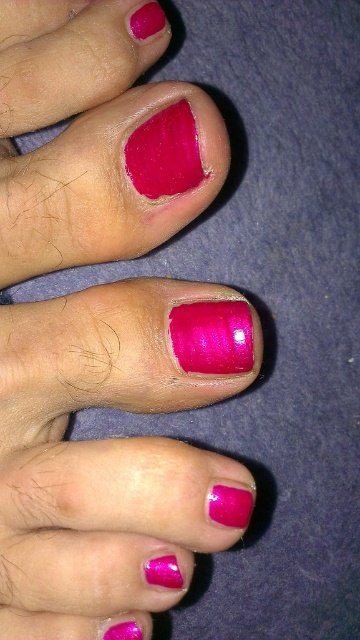
Can you confirm if glossy pink nail at center is positioned to the left of glossy pink nail polish at center?

Indeed, glossy pink nail at center is positioned on the left side of glossy pink nail polish at center.

Is glossy pink nail at center below glossy pink nail polish at center?

Incorrect, glossy pink nail at center is not positioned below glossy pink nail polish at center.

What do you see at coordinates (106, 464) in the screenshot?
I see `glossy pink nail at center` at bounding box center [106, 464].

Locate an element on the screen. glossy pink nail at center is located at coordinates (106, 464).